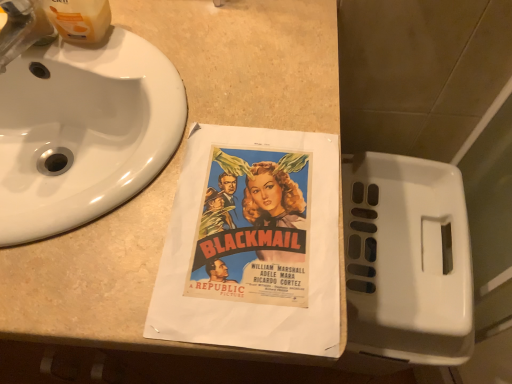
Question: In the image, is brushed metal faucet at upper left on the left side or the right side of white glossy sink at upper left?

Choices:
 (A) left
 (B) right

Answer: (A)

Question: Is brushed metal faucet at upper left wider or thinner than white glossy sink at upper left?

Choices:
 (A) thin
 (B) wide

Answer: (A)

Question: Which object is the farthest from the brushed metal faucet at upper left?

Choices:
 (A) white glossy sink at upper left
 (B) beige laminate counter at center

Answer: (B)

Question: Which object is the farthest from the beige laminate counter at center?

Choices:
 (A) white glossy sink at upper left
 (B) brushed metal faucet at upper left

Answer: (B)